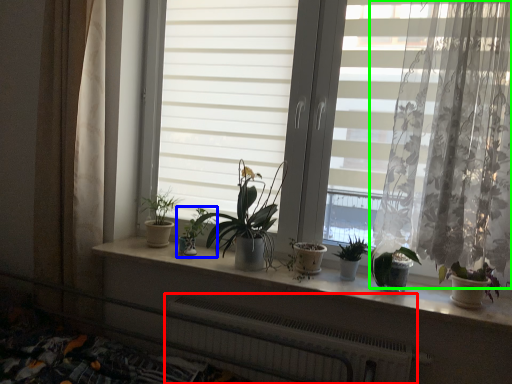
Question: Which is nearer to the radiator (highlighted by a red box)? houseplant (highlighted by a blue box) or curtain (highlighted by a green box).

Choices:
 (A) houseplant
 (B) curtain

Answer: (A)